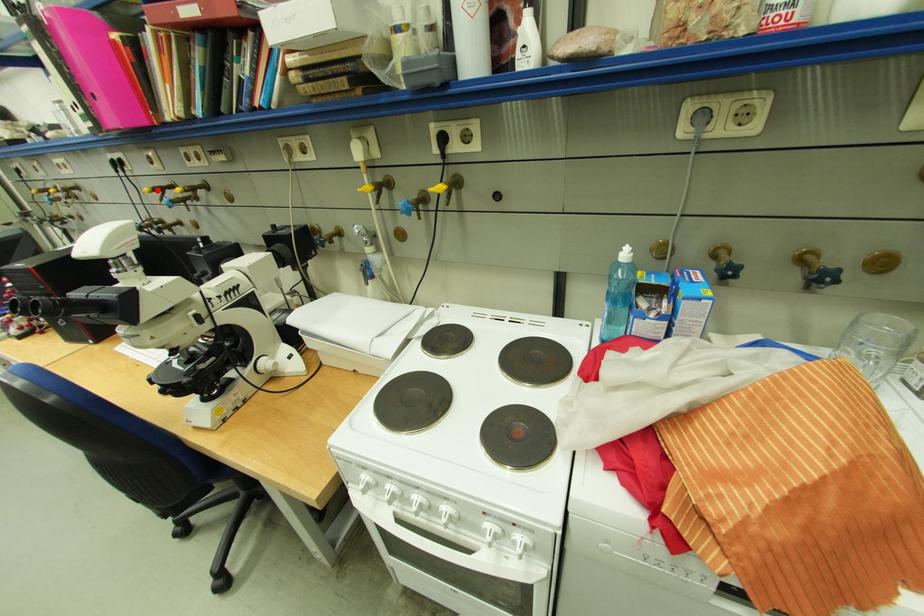
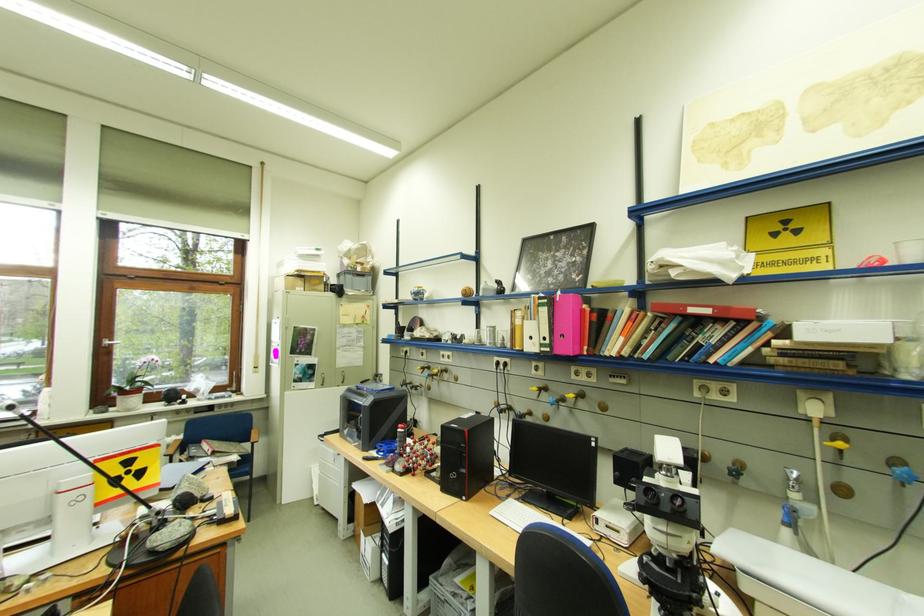
The point at the highlighted location is marked in the first image. Where is the corresponding point in the second image?

(544, 390)